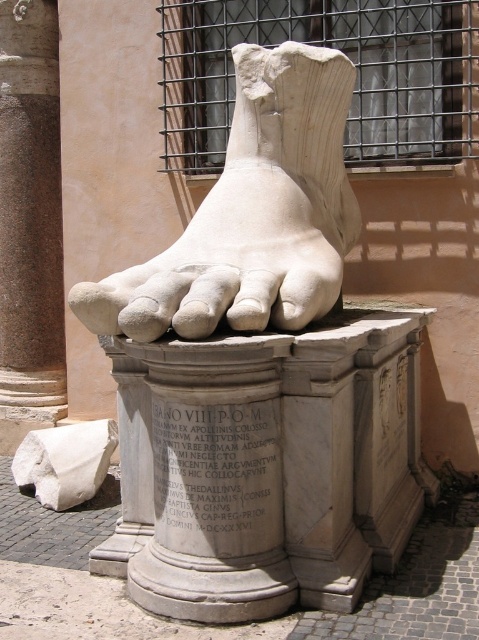
Looking at this image, is granite column at left taller than white marble block at lower left?

Correct, granite column at left is much taller as white marble block at lower left.

This screenshot has height=640, width=479. Find the location of `granite column at left`. granite column at left is located at coordinates (30, 221).

Who is more forward, (22, 356) or (78, 490)?

Point (78, 490) is more forward.

Locate an element on the screen. The width and height of the screenshot is (479, 640). granite column at left is located at coordinates (30, 221).

Is point (305, 113) positioned in front of point (55, 316)?

Yes, point (305, 113) is in front of point (55, 316).

The height and width of the screenshot is (640, 479). What are the coordinates of `white marble foot at center` in the screenshot? It's located at (252, 212).

Identify the location of white marble foot at center. (252, 212).

The image size is (479, 640). Describe the element at coordinates (252, 212) in the screenshot. I see `white marble foot at center` at that location.

Looking at this image, is white marble foot at center bigger than white marble block at lower left?

Yes.

Is point (298, 243) in front of point (64, 445)?

Yes, point (298, 243) is in front of point (64, 445).

Find the location of `white marble foot at center`. white marble foot at center is located at coordinates (252, 212).